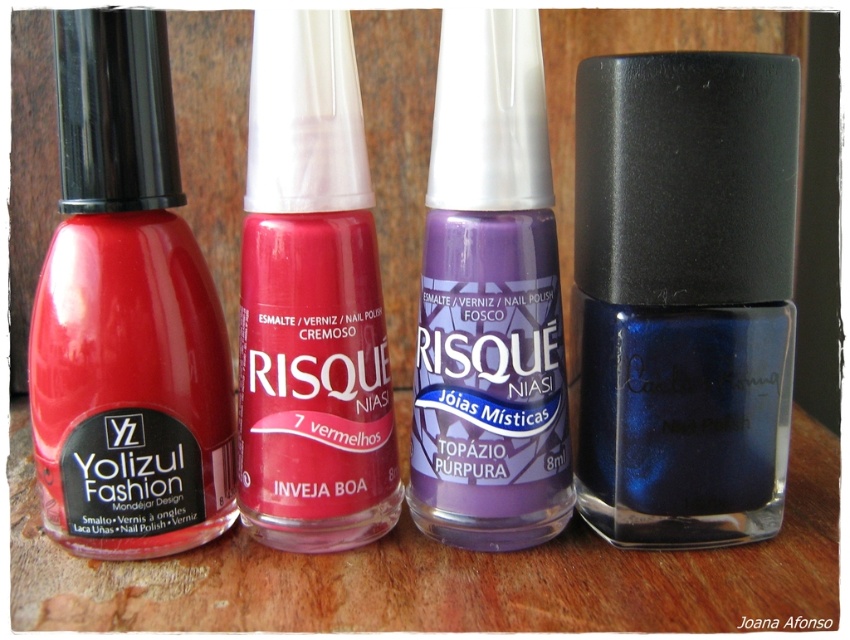
Which nail polish bottle is located at the coordinate point (684, 294)?

The glossy blue nail polish at right is located at the coordinate point (684, 294).

You are organizing nail polish bottles on a shelf. You have a glossy blue nail polish at right and a matte glass nail polish at left. According to the image, which one is positioned lower on the shelf?

The glossy blue nail polish at right is positioned lower on the shelf than the matte glass nail polish at left.

You are organizing a display and need to place a new nail polish bottle between the glossy blue nail polish at right and the matte glass nail polish at left. The new bottle is 3 inches wide. Can it fit in the space between them?

The space between the glossy blue nail polish at right and the matte glass nail polish at left is 18.40 inches. Since the new bottle is only 3 inches wide, it can easily fit in the available space.